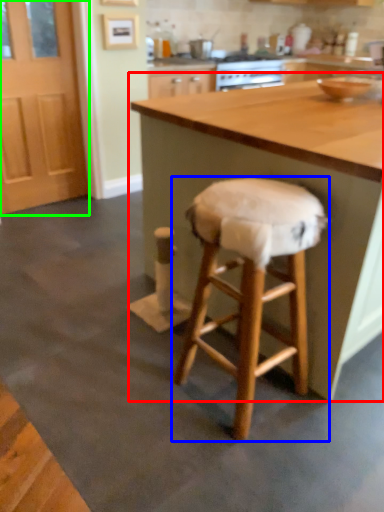
Question: Which is nearer to the table (highlighted by a red box)? stool (highlighted by a blue box) or screen door (highlighted by a green box).

Choices:
 (A) stool
 (B) screen door

Answer: (A)